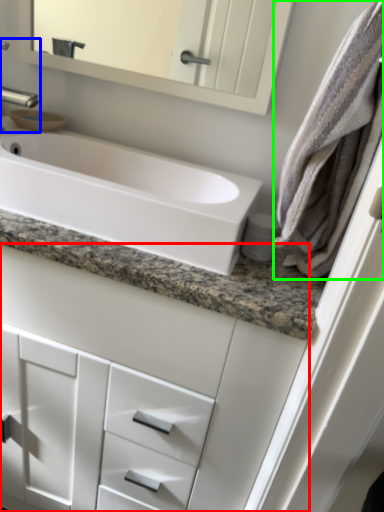
Question: Which object is the closest to the bathroom cabinet (highlighted by a red box)? Choose among these: tap (highlighted by a blue box) or bath towel (highlighted by a green box).

Choices:
 (A) tap
 (B) bath towel

Answer: (B)